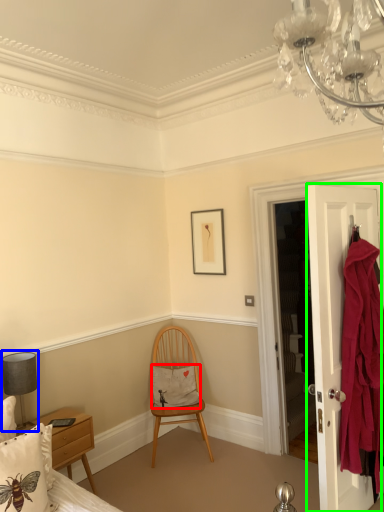
Question: Based on their relative distances, which object is farther from pillow (highlighted by a red box)? Choose from lamp (highlighted by a blue box) and door (highlighted by a green box).

Choices:
 (A) lamp
 (B) door

Answer: (B)